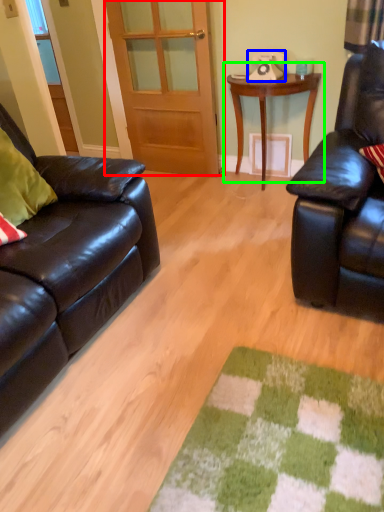
Question: Based on their relative distances, which object is farther from door (highlighted by a red box)? Choose from corded phone (highlighted by a blue box) and table (highlighted by a green box).

Choices:
 (A) corded phone
 (B) table

Answer: (A)